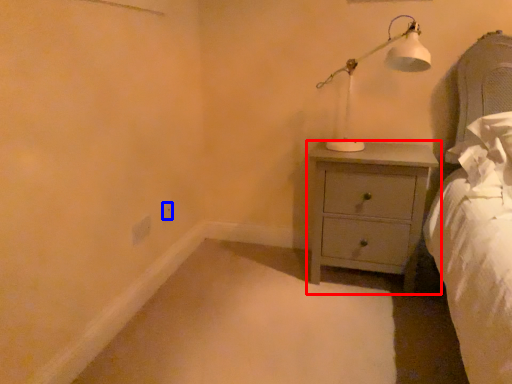
Question: Which point is closer to the camera, chest of drawers (highlighted by a red box) or electric outlet (highlighted by a blue box)?

Choices:
 (A) chest of drawers
 (B) electric outlet

Answer: (A)